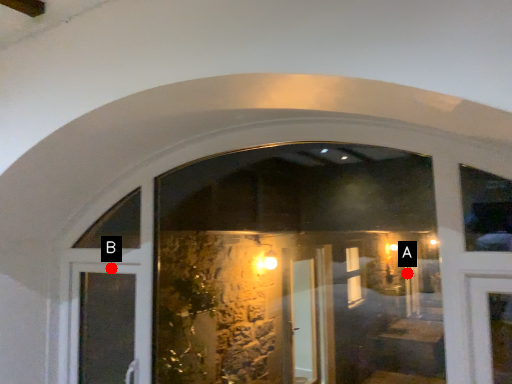
Question: Two points are circled on the image, labeled by A and B beside each circle. Which point is closer to the camera?

Choices:
 (A) A is closer
 (B) B is closer

Answer: (B)